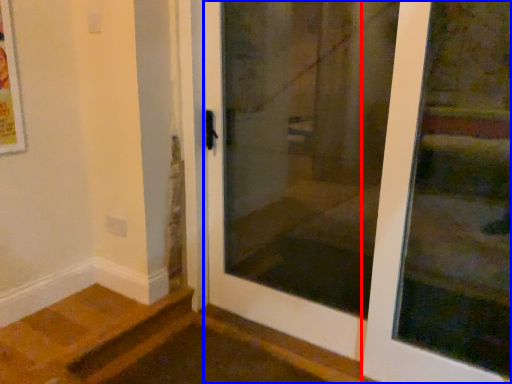
Question: Which object appears farthest to the camera in this image, door (highlighted by a red box) or door (highlighted by a blue box)?

Choices:
 (A) door
 (B) door

Answer: (A)